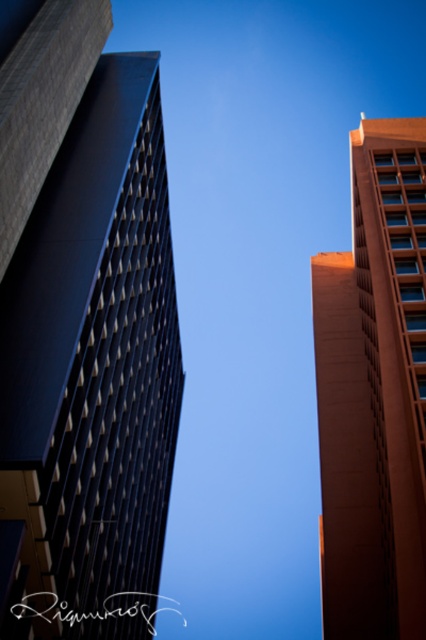
Who is shorter, matte black building at left or orange smooth building at upper right?

With less height is orange smooth building at upper right.

Is matte black building at left to the left of orange smooth building at upper right from the viewer's perspective?

Correct, you'll find matte black building at left to the left of orange smooth building at upper right.

Which is in front, point (40, 605) or point (365, 582)?

Point (40, 605) is more forward.

The image size is (426, 640). I want to click on matte black building at left, so [x=83, y=326].